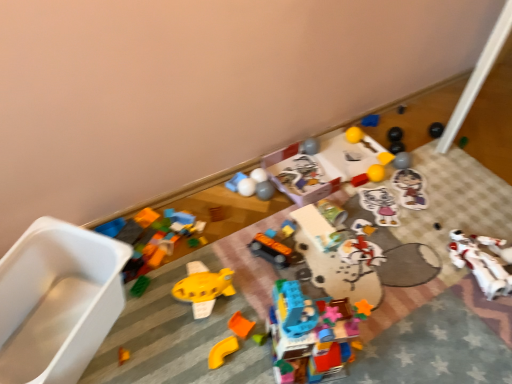
Locate an element on the screen. The width and height of the screenshot is (512, 384). vacant area to the right of yellow rubber ball at upper center, the 3th toy in the right-to-left sequence is located at coordinates (426, 176).